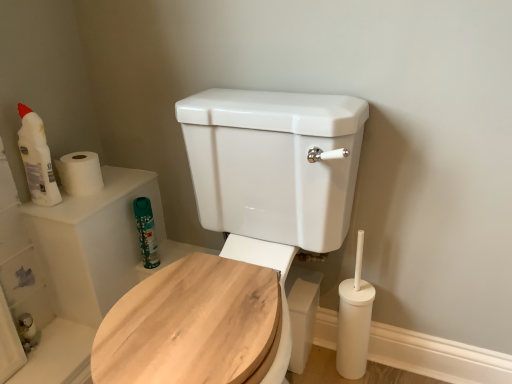
Identify the location of free point behind white matte toilet paper at upper left. (118, 172).